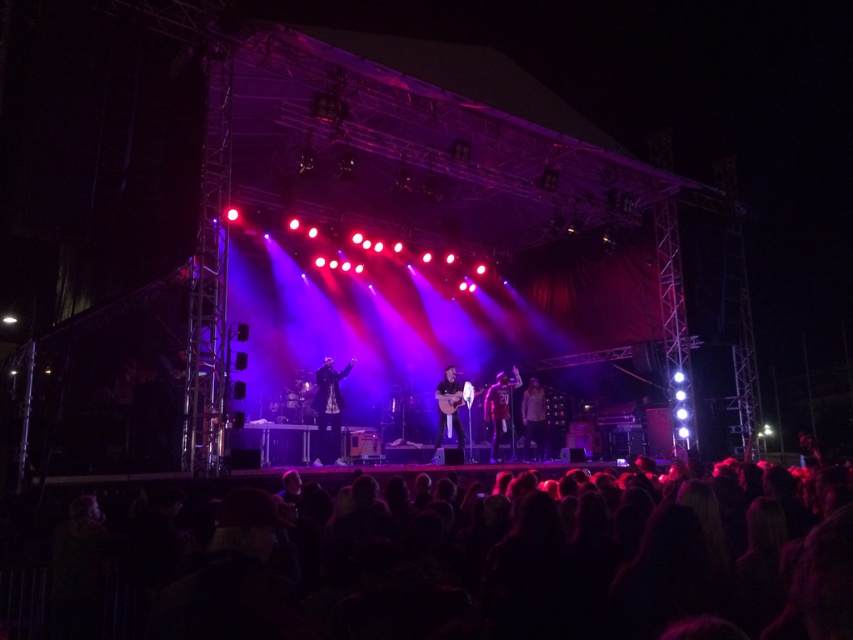
Who is positioned more to the left, black velvet coat at center or matte red shirt at center?

black velvet coat at center

Does black velvet coat at center appear on the right side of matte red shirt at center?

Incorrect, black velvet coat at center is not on the right side of matte red shirt at center.

This screenshot has width=853, height=640. What do you see at coordinates (328, 408) in the screenshot? I see `black velvet coat at center` at bounding box center [328, 408].

Find the location of a particular element. black velvet coat at center is located at coordinates (328, 408).

Is black hair at lower center further to camera compared to shiny metallic jacket at center?

No, it is not.

Looking at this image, can you confirm if black hair at lower center is positioned to the left of shiny metallic jacket at center?

Indeed, black hair at lower center is positioned on the left side of shiny metallic jacket at center.

Between point (755, 554) and point (532, 403), which one is positioned behind?

The point (532, 403) is more distant.

Find the location of a particular element. The image size is (853, 640). black hair at lower center is located at coordinates [465, 561].

Is point (329, 369) behind point (521, 403)?

No, it is in front of (521, 403).

Is black velvet coat at center to the right of shiny metallic jacket at center from the viewer's perspective?

In fact, black velvet coat at center is to the left of shiny metallic jacket at center.

Is point (328, 410) behind point (543, 438)?

No.

The height and width of the screenshot is (640, 853). In order to click on black velvet coat at center in this screenshot , I will do `click(328, 408)`.